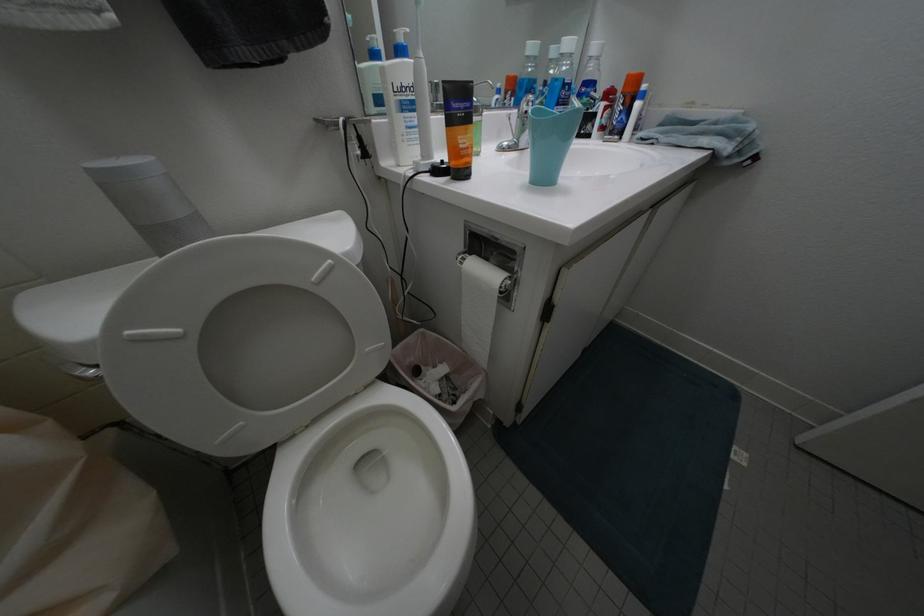
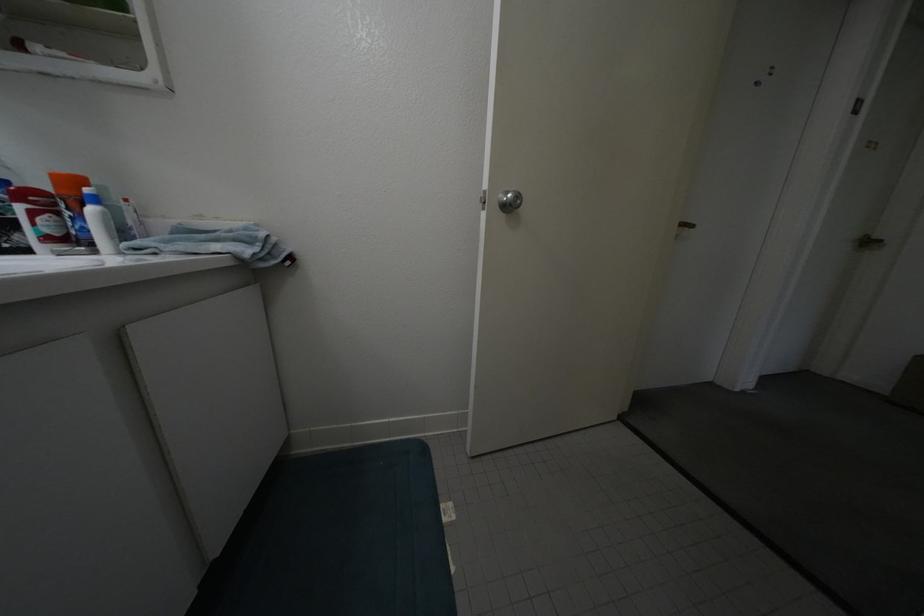
Question: Based on the continuous images, in which direction is the camera rotating? Reply with the corresponding letter.

Choices:
 (A) Left
 (B) Right
 (C) Up
 (D) Down

Answer: (B)